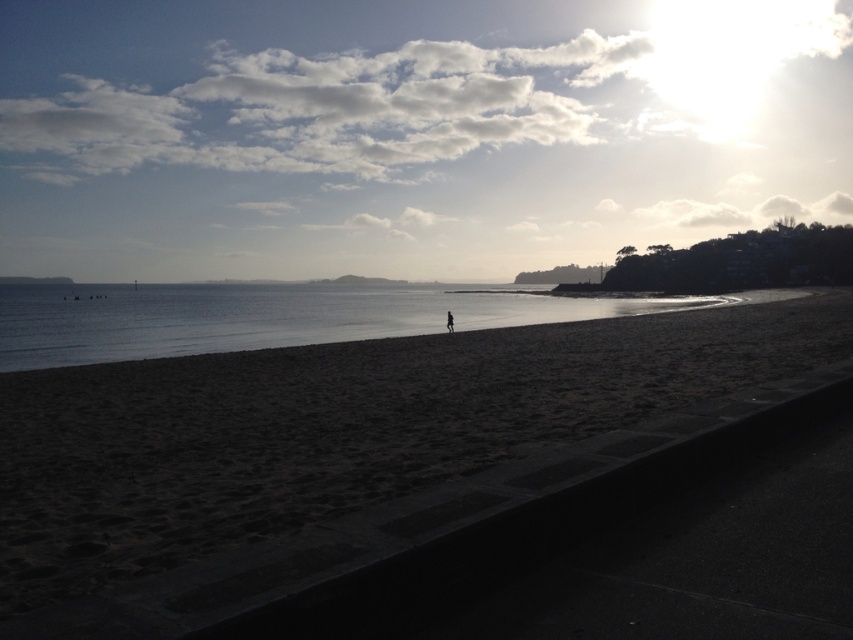
You are a photographer trying to capture the black fabric person at center and the clear water at center in a single shot. Based on their sizes, which one will occupy more of the frame?

The clear water at center is larger in size than the black fabric person at center, so it will occupy more of the frame.

You are a beachgoer planning to build a sandcastle. You have two options for locations on the beach. The first is the dark sand at center, and the second is the clear water at center. Which location would you choose and why?

You should choose the dark sand at center because it occupies less space than the clear water at center, making it a more stable and suitable area for building a sandcastle.